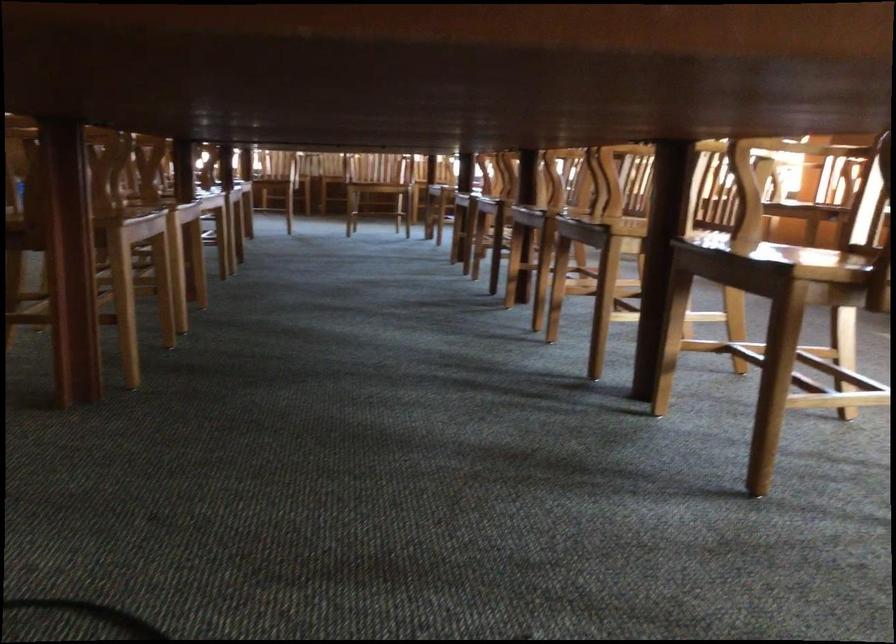
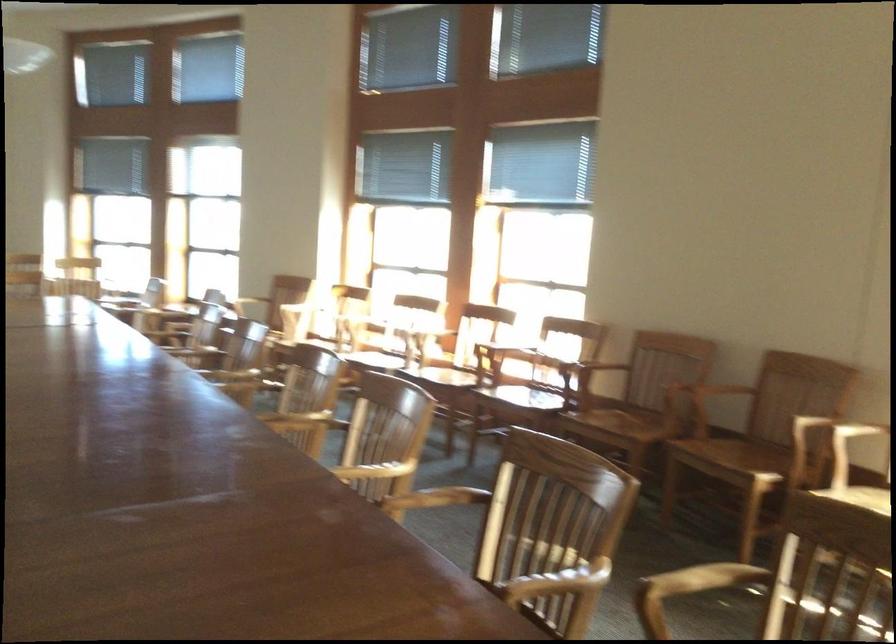
Question: Which direction would the cameraman need to move to produce the second image? Reply with the corresponding letter.

Choices:
 (A) Left
 (B) Right
 (C) Forward
 (D) Backward

Answer: (D)